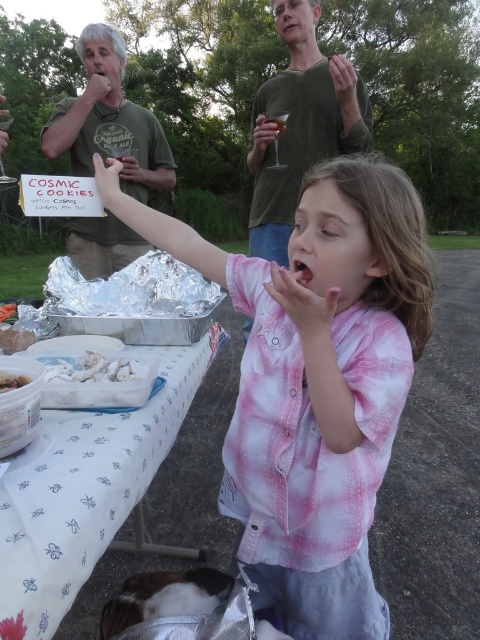
Between green t-shirt at upper left and white crumbly food at upper left, which one has less height?

white crumbly food at upper left is shorter.

Does green t-shirt at upper left appear over white crumbly food at upper left?

Yes, green t-shirt at upper left is above white crumbly food at upper left.

Find the location of a particular element. This screenshot has height=640, width=480. green t-shirt at upper left is located at coordinates (108, 122).

In the scene shown: Is pink plaid shirt at center taller than green t-shirt at upper left?

Yes, pink plaid shirt at center is taller than green t-shirt at upper left.

Can you confirm if pink plaid shirt at center is thinner than green t-shirt at upper left?

Incorrect, pink plaid shirt at center's width is not less than green t-shirt at upper left's.

Does point (242, 282) come farther from viewer compared to point (83, 51)?

No, it is in front of (83, 51).

Locate an element on the screen. The width and height of the screenshot is (480, 640). pink plaid shirt at center is located at coordinates (314, 381).

Is pink plaid shirt at center above white crumbly food at upper left?

No.

Which is behind, point (308, 291) or point (1, 310)?

Point (1, 310)

Which is behind, point (262, 342) or point (14, 305)?

The point (14, 305) is more distant.

I want to click on pink plaid shirt at center, so click(314, 381).